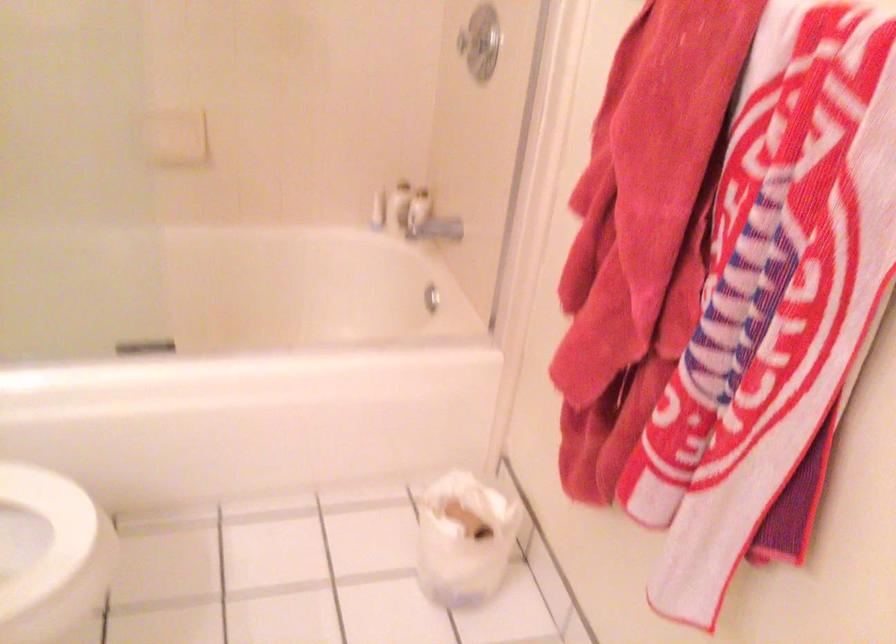
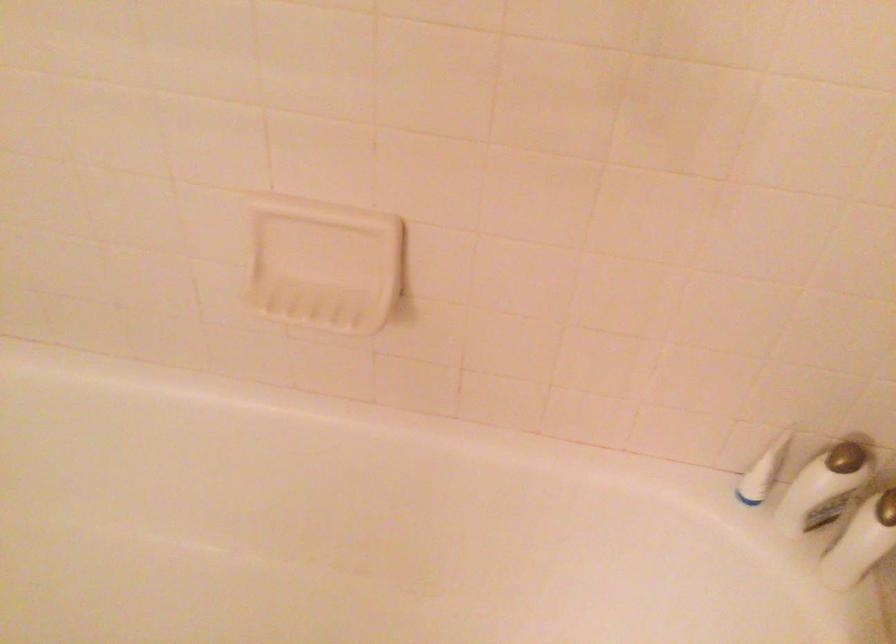
Question: In a continuous first-person perspective shot, in which direction is the camera moving?

Choices:
 (A) Left
 (B) Right
 (C) Forward
 (D) Backward

Answer: (C)